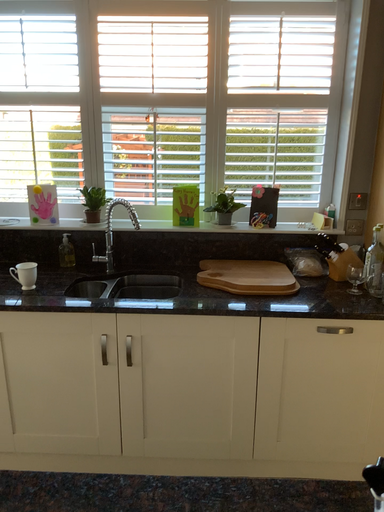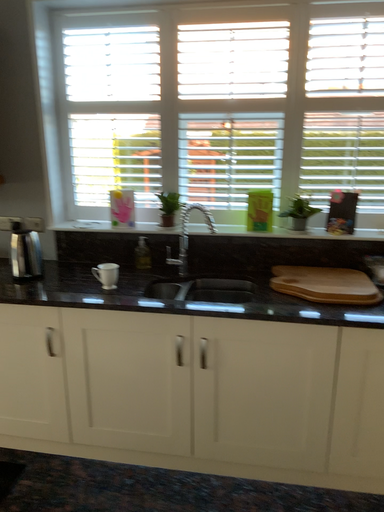
Question: Which way did the camera rotate in the video?

Choices:
 (A) rotated right
 (B) rotated left

Answer: (B)